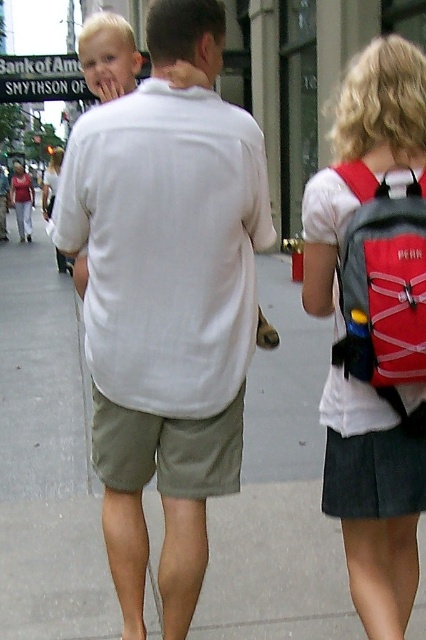
Can you confirm if red fabric backpack at upper right is thinner than khaki cotton shorts at center?

Correct, red fabric backpack at upper right's width is less than khaki cotton shorts at center's.

Between point (382, 132) and point (123, 492), which one is positioned in front?

Positioned in front is point (382, 132).

Between point (351, 426) and point (221, 436), which one is positioned in front?

Point (351, 426) is more forward.

Find the location of a particular element. The height and width of the screenshot is (640, 426). red fabric backpack at upper right is located at coordinates (374, 324).

Is point (184, 348) positioned behind point (39, 516)?

That is False.

Between point (91, 340) and point (270, 404), which one is positioned in front?

Positioned in front is point (91, 340).

Find the location of `white cotton shirt at center`. white cotton shirt at center is located at coordinates (166, 300).

The image size is (426, 640). What do you see at coordinates (374, 324) in the screenshot?
I see `red fabric backpack at upper right` at bounding box center [374, 324].

Does point (409, 611) come closer to viewer compared to point (344, 248)?

No, it is behind (344, 248).

Find the location of a particular element. The image size is (426, 640). red fabric backpack at upper right is located at coordinates [374, 324].